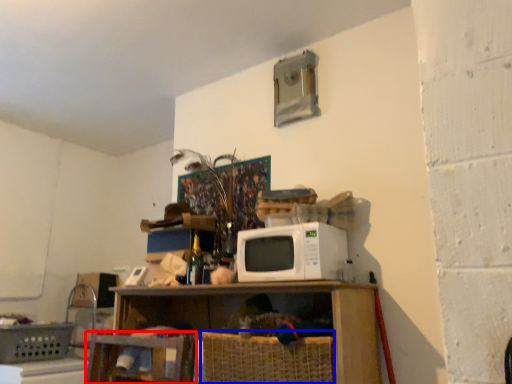
Question: Which object is closer to the camera taking this photo, swivel chair (highlighted by a red box) or basket (highlighted by a blue box)?

Choices:
 (A) swivel chair
 (B) basket

Answer: (B)